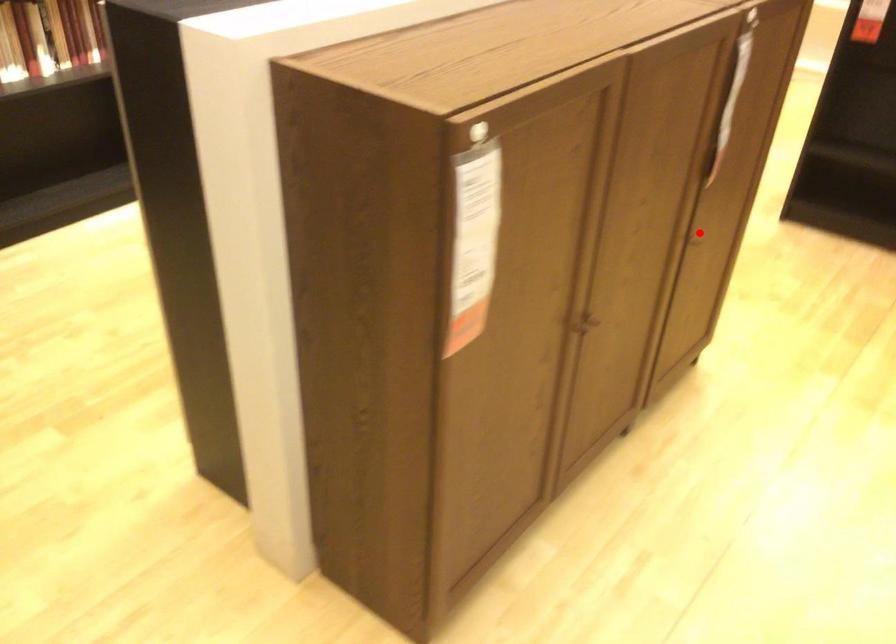
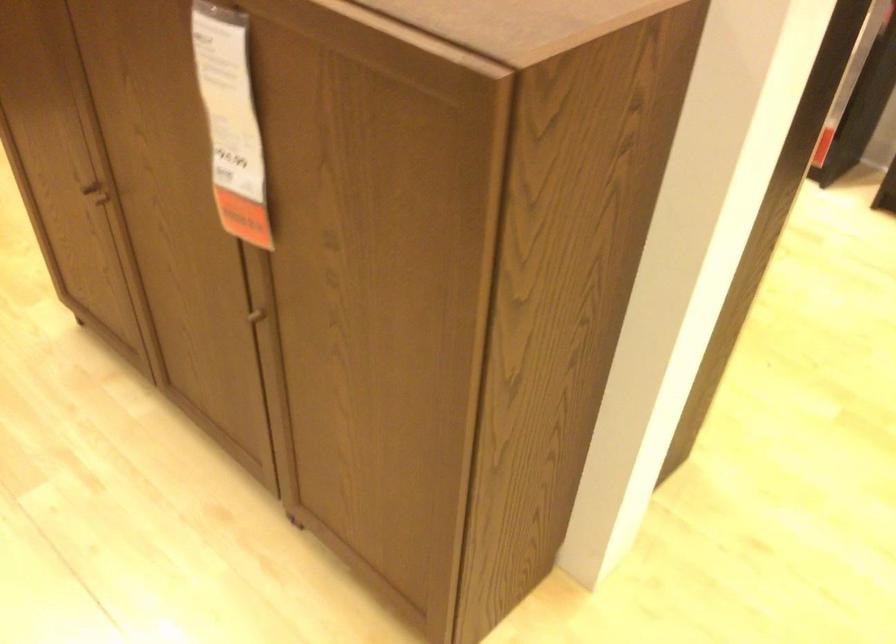
Question: I am providing you with two images of the same scene from different viewpoints. A red point is shown in image1. For the corresponding object point in image2, is it positioned nearer or farther from the camera?

Choices:
 (A) Nearer
 (B) Farther

Answer: (A)